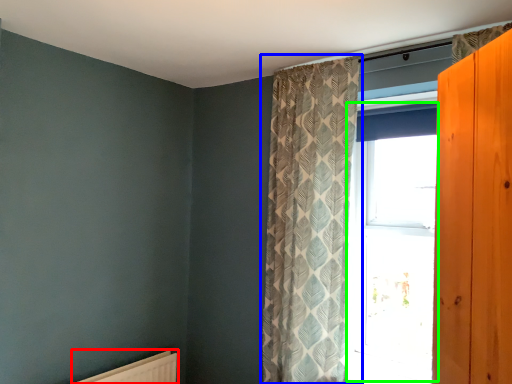
Question: Estimate the real-world distances between objects in this image. Which object is farther from radiator (highlighted by a red box), curtain (highlighted by a blue box) or window (highlighted by a green box)?

Choices:
 (A) curtain
 (B) window

Answer: (B)